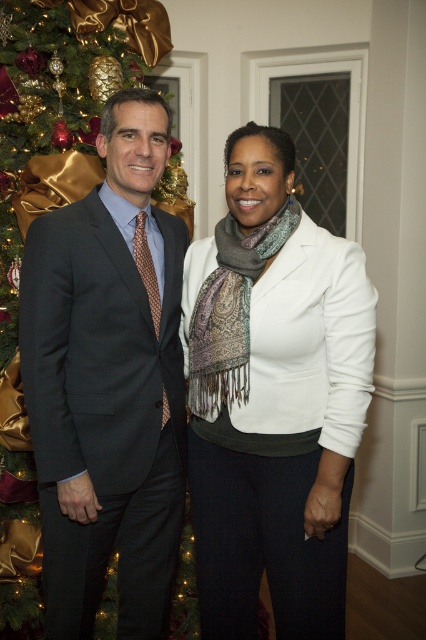
Question: Does matte black suit at center have a lesser width compared to dark gray suit at left?

Choices:
 (A) no
 (B) yes

Answer: (A)

Question: Considering the relative positions of matte black suit at center and dark gray suit at left in the image provided, where is matte black suit at center located with respect to dark gray suit at left?

Choices:
 (A) above
 (B) below

Answer: (A)

Question: Which of the following is the closest to the observer?

Choices:
 (A) (60, 456)
 (B) (169, 518)

Answer: (A)

Question: Is matte black suit at center to the right of dark gray suit at left from the viewer's perspective?

Choices:
 (A) yes
 (B) no

Answer: (A)

Question: Which point is farther to the camera?

Choices:
 (A) (164, 298)
 (B) (98, 234)

Answer: (A)